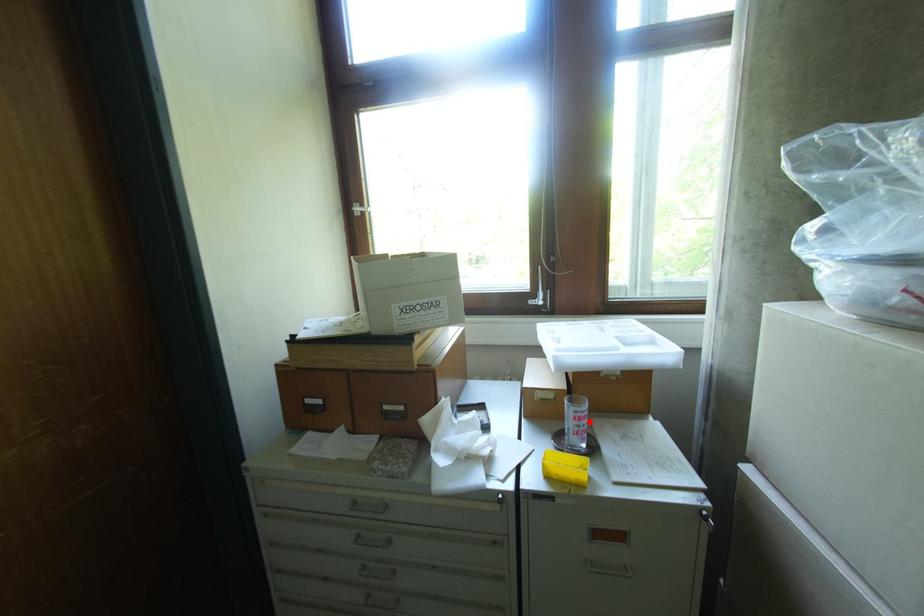
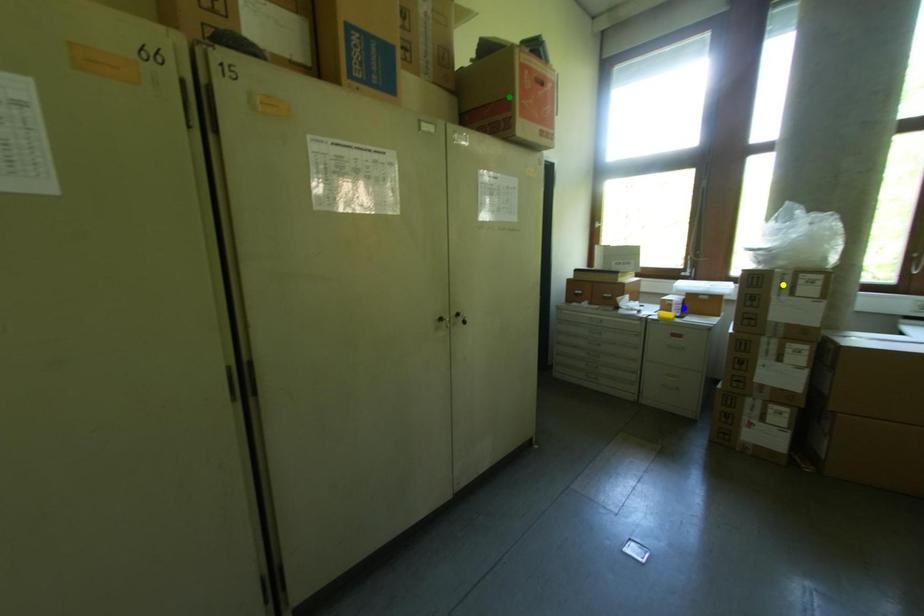
Question: I am providing you with two images of the same scene from different viewpoints. A red point is marked on the first image. You are given multiple points on the second image. Can you choose the point in image 2 that corresponds to the point in image 1?

Choices:
 (A) green point
 (B) blue point
 (C) yellow point

Answer: (B)